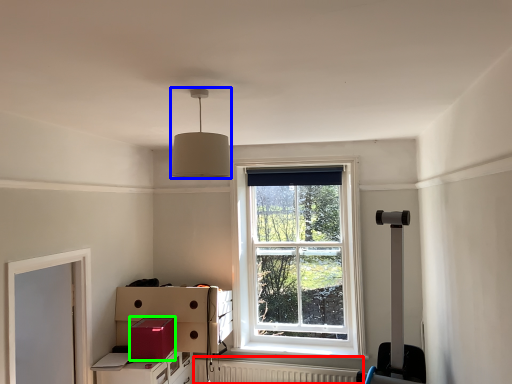
Question: Estimate the real-world distances between objects in this image. Which object is closer to radiator (highlighted by a red box), lamp (highlighted by a blue box) or cardboard box (highlighted by a green box)?

Choices:
 (A) lamp
 (B) cardboard box

Answer: (B)